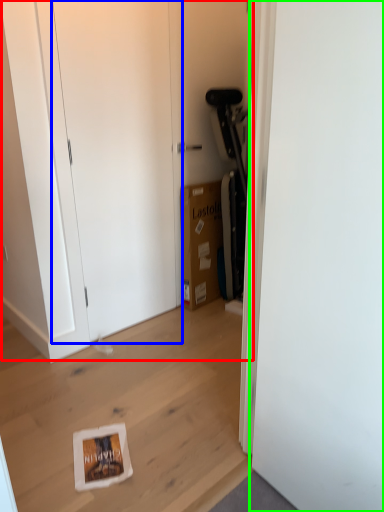
Question: Which object is positioned farthest from dresser (highlighted by a red box)? Select from door (highlighted by a blue box) and door (highlighted by a green box).

Choices:
 (A) door
 (B) door

Answer: (B)